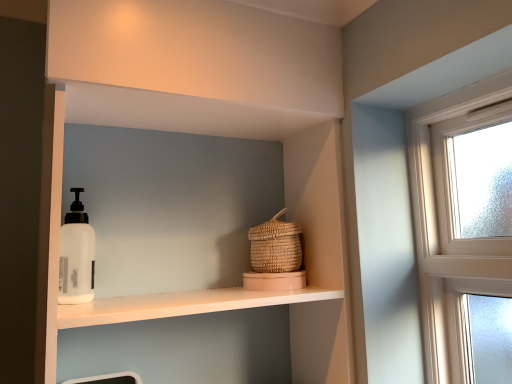
Question: In terms of height, does woven straw basket at center look taller or shorter compared to white matte shelf at center?

Choices:
 (A) short
 (B) tall

Answer: (A)

Question: Relative to white matte shelf at center, is woven straw basket at center in front or behind?

Choices:
 (A) front
 (B) behind

Answer: (B)

Question: From the image's perspective, relative to white matte shelf at center, is woven straw basket at center above or below?

Choices:
 (A) above
 (B) below

Answer: (A)

Question: From a real-world perspective, relative to woven straw basket at center, is white matte shelf at center vertically above or below?

Choices:
 (A) below
 (B) above

Answer: (A)

Question: Looking at their shapes, would you say white matte shelf at center is wider or thinner than woven straw basket at center?

Choices:
 (A) thin
 (B) wide

Answer: (B)

Question: Does point (321, 162) appear closer or farther from the camera than point (291, 251)?

Choices:
 (A) farther
 (B) closer

Answer: (A)

Question: From the image's perspective, is white matte shelf at center above or below woven straw basket at center?

Choices:
 (A) below
 (B) above

Answer: (A)